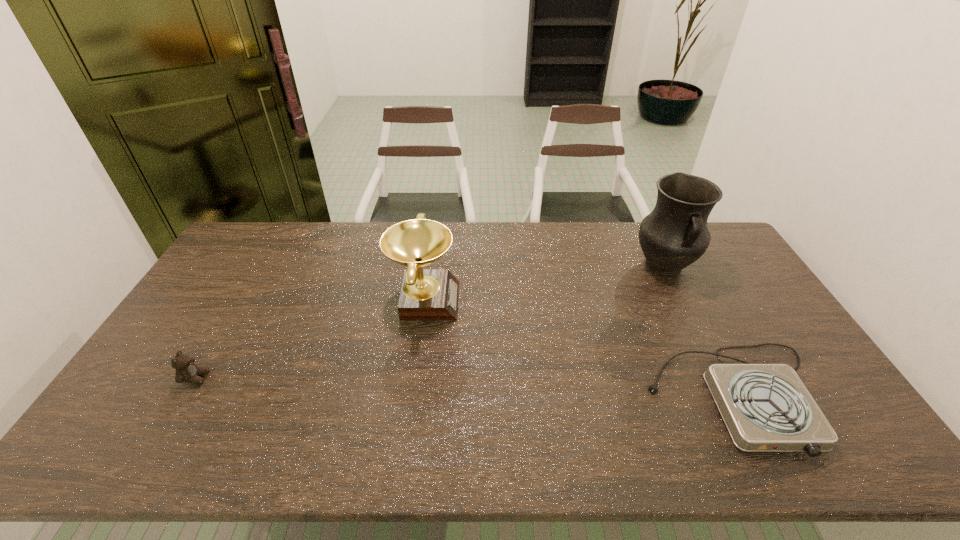
Where is `the tallest object`? the tallest object is located at coordinates (674, 235).

Identify the location of award. Image resolution: width=960 pixels, height=540 pixels. (427, 294).

Image resolution: width=960 pixels, height=540 pixels. What are the coordinates of `the third object from right to left` in the screenshot? It's located at (427, 294).

Identify the location of teddy bear. (186, 371).

Locate an element on the screen. The image size is (960, 540). the leftmost object is located at coordinates (186, 371).

Find the location of a particular element. The image size is (960, 540). hotplate is located at coordinates click(766, 407).

Find the location of a particular element. Image resolution: width=960 pixels, height=540 pixels. vacant space located on the handle side of the pitcher is located at coordinates (712, 363).

This screenshot has width=960, height=540. Identify the location of vacant space located on the front-facing side of the award. (565, 299).

Image resolution: width=960 pixels, height=540 pixels. I want to click on vacant space situated on the face of the teddy bear, so click(x=290, y=378).

In order to click on object located in the far edge section of the desktop in this screenshot , I will do `click(674, 235)`.